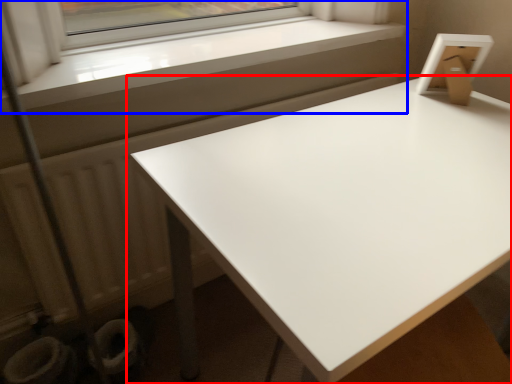
Question: Which point is closer to the camera, table (highlighted by a red box) or window (highlighted by a blue box)?

Choices:
 (A) table
 (B) window

Answer: (A)